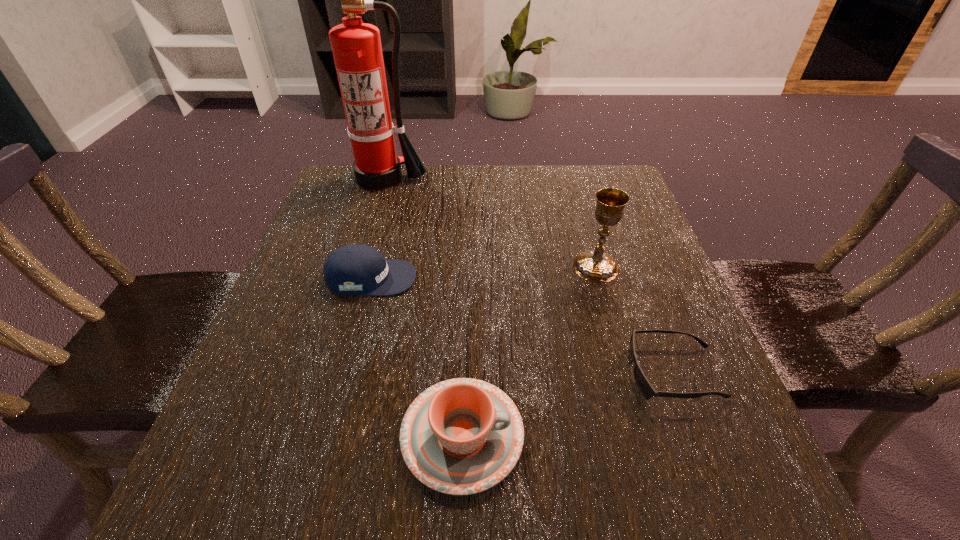
Identify the location of blank space at the far edge of the desktop. The height and width of the screenshot is (540, 960). (529, 192).

The height and width of the screenshot is (540, 960). In the image, there is a desktop. Identify the location of vacant space at the left edge. (280, 322).

The width and height of the screenshot is (960, 540). In the image, there is a desktop. What are the coordinates of `blank space at the right edge` in the screenshot? It's located at (653, 334).

The image size is (960, 540). Identify the location of blank space at the far left corner. coord(338,171).

Locate an element on the screen. The image size is (960, 540). free space at the near left corner of the desktop is located at coordinates (232, 520).

Where is `free spot at the near right corner of the desktop`? free spot at the near right corner of the desktop is located at coordinates (703, 458).

Locate an element on the screen. This screenshot has width=960, height=540. free space between the farthest object and the baseball cap is located at coordinates pos(377,228).

I want to click on unoccupied area between the baseball cap and the farthest object, so click(x=377, y=228).

Locate an element on the screen. unoccupied area between the third object from left to right and the fire extinguisher is located at coordinates (422, 307).

You are a GUI agent. You are given a task and a screenshot of the screen. Output one action in this format:
    pyautogui.click(x=<x>, y=<y>)
    Task: Click on the vacant area between the tallest object and the chinaware
    The width and height of the screenshot is (960, 540).
    Given the screenshot: What is the action you would take?
    pyautogui.click(x=422, y=307)